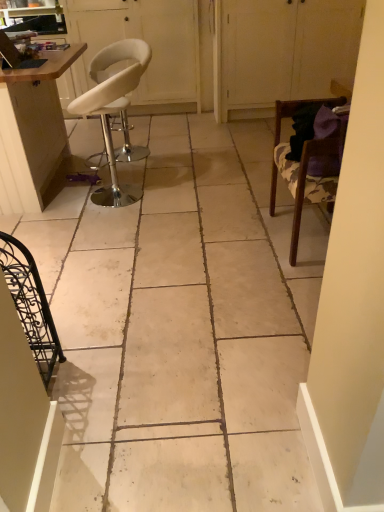
Where is `free space in front of white leather stool at left, which ranks as the third chair in front-to-back order`? This screenshot has height=512, width=384. free space in front of white leather stool at left, which ranks as the third chair in front-to-back order is located at coordinates tap(113, 227).